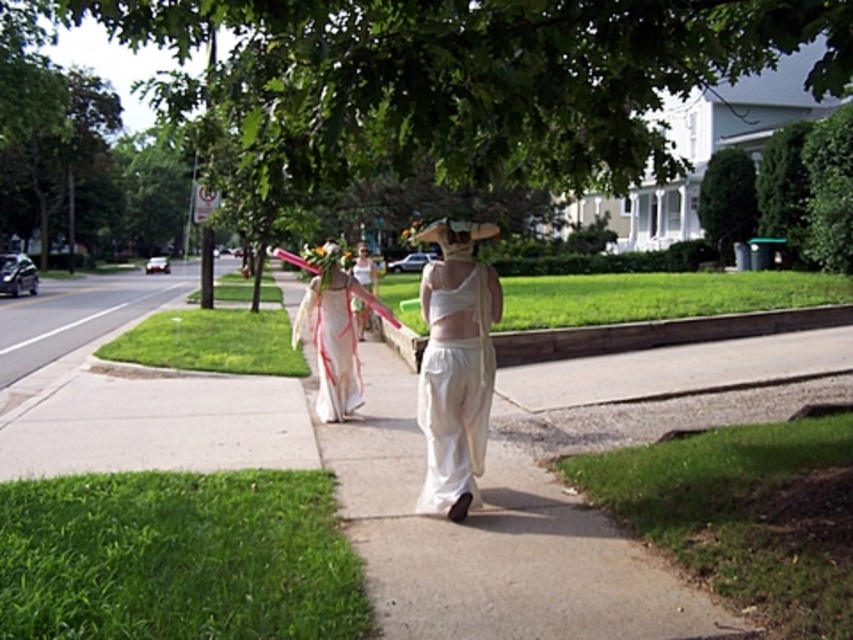
Is green leafy tree at center further to camera compared to white cotton dress at center?

No, it is not.

Is point (843, 19) positioned in front of point (350, 304)?

Yes.

The width and height of the screenshot is (853, 640). Identify the location of green leafy tree at center. (445, 77).

Is white sheer fabric dress at center below white satin dress at center?

No.

The height and width of the screenshot is (640, 853). What do you see at coordinates (454, 394) in the screenshot? I see `white sheer fabric dress at center` at bounding box center [454, 394].

Locate an element on the screen. white sheer fabric dress at center is located at coordinates (454, 394).

Who is lower down, green leafy tree at center or white satin dress at center?

white satin dress at center is lower down.

Based on the photo, is green leafy tree at center shorter than white satin dress at center?

In fact, green leafy tree at center may be taller than white satin dress at center.

Image resolution: width=853 pixels, height=640 pixels. Describe the element at coordinates (445, 77) in the screenshot. I see `green leafy tree at center` at that location.

The width and height of the screenshot is (853, 640). In order to click on green leafy tree at center in this screenshot , I will do `click(445, 77)`.